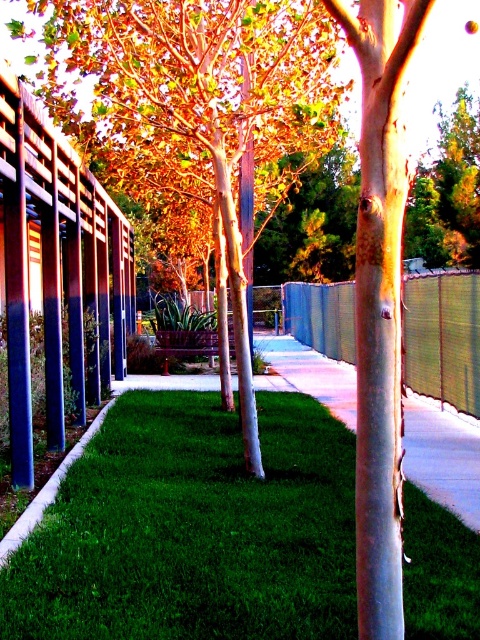
Is green grass at center thinner than smooth white tree at center?

Yes.

Where is `green grass at center`? green grass at center is located at coordinates [193, 529].

You are a GUI agent. You are given a task and a screenshot of the screen. Output one action in this format:
    pyautogui.click(x=<x>, y=<y>)
    Task: Click on the green grass at center
    The height and width of the screenshot is (640, 480).
    Given the screenshot: What is the action you would take?
    pyautogui.click(x=193, y=529)

Which is more to the left, green grass at center or metallic woven fence at center?

green grass at center

Is green grass at center positioned in front of metallic woven fence at center?

That is True.

Is point (285, 480) behind point (434, 276)?

No, (285, 480) is in front of (434, 276).

This screenshot has height=640, width=480. I want to click on green grass at center, so click(x=193, y=529).

This screenshot has height=640, width=480. Describe the element at coordinates (202, 108) in the screenshot. I see `smooth white tree at center` at that location.

Does point (216, 100) lie in front of point (404, 308)?

No, (216, 100) is behind (404, 308).

The width and height of the screenshot is (480, 640). What are the coordinates of `smooth white tree at center` in the screenshot? It's located at (202, 108).